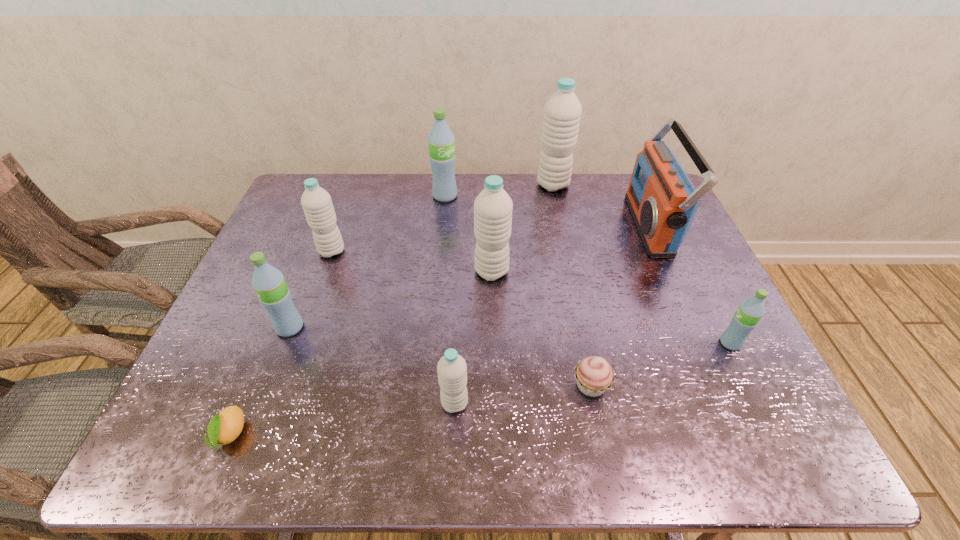
I want to click on the rightmost green water bottle, so click(745, 319).

Where is `the second white water bottle from left to right`? Image resolution: width=960 pixels, height=540 pixels. the second white water bottle from left to right is located at coordinates (452, 370).

You are a GUI agent. You are given a task and a screenshot of the screen. Output one action in this format:
    pyautogui.click(x=<x>, y=<y>)
    Task: Click on the nearest white water bottle
    Image resolution: width=960 pixels, height=540 pixels.
    Given the screenshot: What is the action you would take?
    pyautogui.click(x=452, y=370)

The height and width of the screenshot is (540, 960). I want to click on pink cupcake, so click(x=594, y=375).

Locate an element on the screen. the ninth tallest object is located at coordinates point(594,375).

Image resolution: width=960 pixels, height=540 pixels. What are the coordinates of `the shortest object` in the screenshot? It's located at (226, 426).

Locate an element on the screen. yellow lemon is located at coordinates (226, 426).

This screenshot has width=960, height=540. Find the location of `vacant space located 0.160m on the front of the tallest object`. vacant space located 0.160m on the front of the tallest object is located at coordinates (561, 224).

Find the location of a particular element. The height and width of the screenshot is (540, 960). vacant space situated on the right of the biggest green water bottle is located at coordinates (475, 196).

Identify the location of free location located on the back of the third smallest white water bottle. point(491,219).